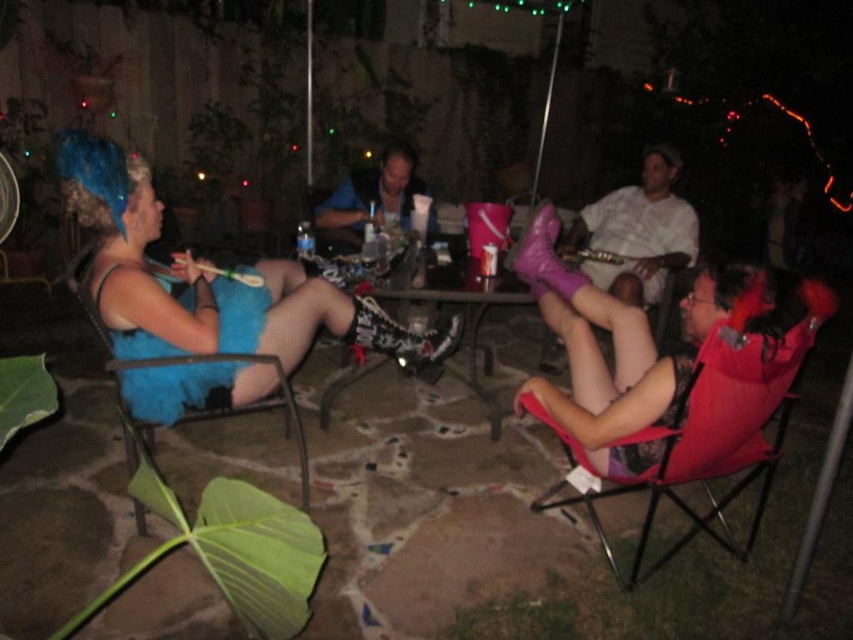
Question: Which point is closer to the camera?

Choices:
 (A) pyautogui.click(x=209, y=353)
 (B) pyautogui.click(x=573, y=234)

Answer: (A)

Question: Among these points, which one is farthest from the camera?

Choices:
 (A) (146, 376)
 (B) (663, 396)
 (C) (479, 289)

Answer: (C)

Question: Is blue mesh dress at left closer to the viewer compared to blue fuzzy dress at left?

Choices:
 (A) yes
 (B) no

Answer: (B)

Question: Does blue mesh dress at left come in front of pink suede boots at right?

Choices:
 (A) yes
 (B) no

Answer: (B)

Question: Is pink suede boots at right closer to the viewer compared to blue fuzzy dress at left?

Choices:
 (A) yes
 (B) no

Answer: (B)

Question: Which point is closer to the camera?

Choices:
 (A) metallic silver table at center
 (B) blue fuzzy dress at left

Answer: (B)